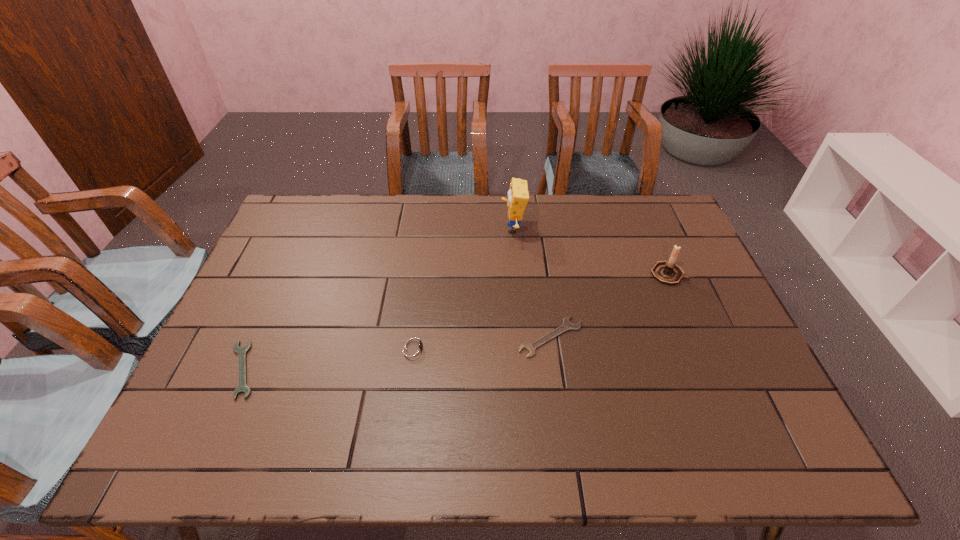
This screenshot has width=960, height=540. I want to click on vacant space at the left edge of the desktop, so click(238, 366).

Where is `vacant space at the far left corner of the desktop`? vacant space at the far left corner of the desktop is located at coordinates (309, 227).

The width and height of the screenshot is (960, 540). I want to click on vacant space at the far right corner of the desktop, so click(680, 234).

The height and width of the screenshot is (540, 960). Identify the location of unoccupied position between the third shortest object and the right wrench. (482, 342).

Find the location of a particular element. Image resolution: width=960 pixels, height=540 pixels. vacant area that lies between the farthest object and the candle holder is located at coordinates (590, 251).

Identify the location of vacant point located between the fourth object from right to left and the right wrench. (482, 342).

Find the location of `vacant area between the second tallest object and the second object from left to right`. vacant area between the second tallest object and the second object from left to right is located at coordinates (540, 311).

The height and width of the screenshot is (540, 960). Find the location of `vacant area between the fourth object from right to left and the candle holder`. vacant area between the fourth object from right to left and the candle holder is located at coordinates (540, 311).

The width and height of the screenshot is (960, 540). What are the coordinates of `empty location between the leftmost object and the sponge` in the screenshot? It's located at (377, 299).

Find the location of a particular element. This screenshot has height=540, width=960. vacant area that lies between the right wrench and the second tallest object is located at coordinates coord(609,306).